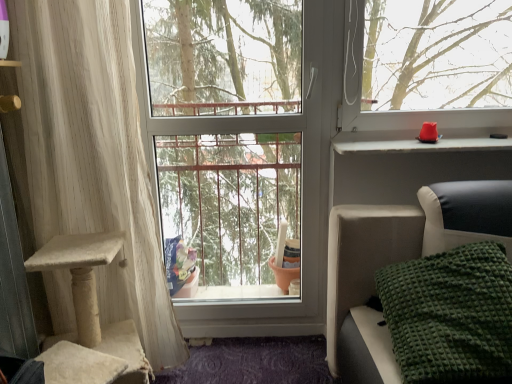
Question: Are white textured curtain at left and transparent glass window at center beside each other?

Choices:
 (A) no
 (B) yes

Answer: (A)

Question: Is white textured curtain at left positioned far away from transparent glass window at center?

Choices:
 (A) yes
 (B) no

Answer: (B)

Question: Considering the relative sizes of white textured curtain at left and transparent glass window at center in the image provided, is white textured curtain at left smaller than transparent glass window at center?

Choices:
 (A) no
 (B) yes

Answer: (A)

Question: Is white textured curtain at left positioned beyond the bounds of transparent glass window at center?

Choices:
 (A) yes
 (B) no

Answer: (A)

Question: Is white textured curtain at left bigger than transparent glass window at center?

Choices:
 (A) yes
 (B) no

Answer: (A)

Question: Considering the positions of matte plastic window sill at upper right and white textured curtain at left in the image, is matte plastic window sill at upper right wider or thinner than white textured curtain at left?

Choices:
 (A) thin
 (B) wide

Answer: (B)

Question: Do you think matte plastic window sill at upper right is within white textured curtain at left, or outside of it?

Choices:
 (A) inside
 (B) outside

Answer: (B)

Question: From a real-world perspective, is matte plastic window sill at upper right positioned above or below white textured curtain at left?

Choices:
 (A) below
 (B) above

Answer: (B)

Question: Considering the relative positions of matte plastic window sill at upper right and white textured curtain at left in the image provided, is matte plastic window sill at upper right to the left or to the right of white textured curtain at left?

Choices:
 (A) right
 (B) left

Answer: (A)

Question: Would you say matte plastic window sill at upper right is to the left or to the right of green textured blanket at lower right in the picture?

Choices:
 (A) left
 (B) right

Answer: (B)

Question: Is matte plastic window sill at upper right wider or thinner than green textured blanket at lower right?

Choices:
 (A) wide
 (B) thin

Answer: (B)

Question: Is matte plastic window sill at upper right bigger or smaller than green textured blanket at lower right?

Choices:
 (A) small
 (B) big

Answer: (A)

Question: Is point (348, 148) closer or farther from the camera than point (354, 206)?

Choices:
 (A) closer
 (B) farther

Answer: (B)

Question: From a real-world perspective, is green textured blanket at lower right physically located above or below matte plastic window sill at upper right?

Choices:
 (A) below
 (B) above

Answer: (A)

Question: Is green textured blanket at lower right in front of or behind matte plastic window sill at upper right in the image?

Choices:
 (A) behind
 (B) front

Answer: (B)